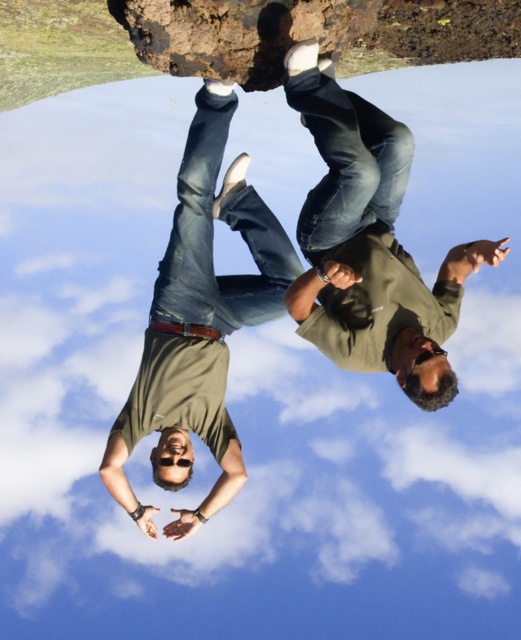
Question: Is green matte shirt at center above matte khaki shirt at center?

Choices:
 (A) no
 (B) yes

Answer: (B)

Question: From the image, what is the correct spatial relationship of green matte shirt at center in relation to matte khaki shirt at center?

Choices:
 (A) left
 (B) right

Answer: (B)

Question: Which point is closer to the camera?

Choices:
 (A) matte khaki shirt at center
 (B) green matte shirt at center

Answer: (B)

Question: Does green matte shirt at center have a smaller size compared to matte khaki shirt at center?

Choices:
 (A) yes
 (B) no

Answer: (A)